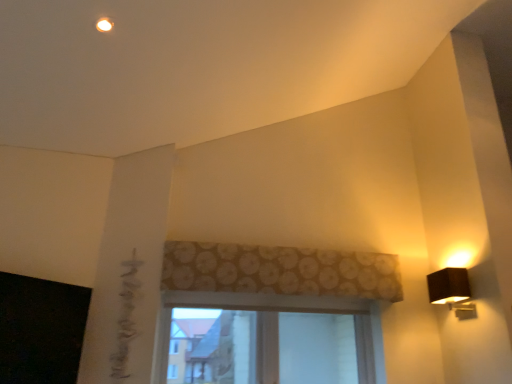
Image resolution: width=512 pixels, height=384 pixels. What are the coordinates of `black matte window screen at lower left` in the screenshot? It's located at (41, 330).

Describe the element at coordinates (452, 291) in the screenshot. I see `black fabric lamp at right` at that location.

This screenshot has height=384, width=512. Find the location of `black fabric lamp at right`. black fabric lamp at right is located at coordinates (452, 291).

The width and height of the screenshot is (512, 384). Find the location of `black matte window screen at lower left`. black matte window screen at lower left is located at coordinates (41, 330).

In the scene shown: From the image's perspective, is brown floral fabric at center beneath black fabric lamp at right?

No, from the image's perspective, brown floral fabric at center is not beneath black fabric lamp at right.

Is brown floral fabric at center positioned far away from black fabric lamp at right?

No.

Based on the photo, from a real-world perspective, is brown floral fabric at center on black fabric lamp at right?

Yes, from a real-world perspective, brown floral fabric at center is over black fabric lamp at right

Does brown floral fabric at center appear on the left side of clear glass window at center?

No, brown floral fabric at center is not to the left of clear glass window at center.

From a real-world perspective, is brown floral fabric at center located higher than clear glass window at center?

Indeed, from a real-world perspective, brown floral fabric at center stands above clear glass window at center.

Can you confirm if brown floral fabric at center is smaller than clear glass window at center?

Yes, brown floral fabric at center is smaller than clear glass window at center.

Looking at the image, does black fabric lamp at right seem bigger or smaller compared to black matte window screen at lower left?

Clearly, black fabric lamp at right is smaller in size than black matte window screen at lower left.

Can you confirm if black fabric lamp at right is shorter than black matte window screen at lower left?

Correct, black fabric lamp at right is not as tall as black matte window screen at lower left.

Between black fabric lamp at right and black matte window screen at lower left, which one is positioned in front?

black matte window screen at lower left is closer to the camera.

How distant is black fabric lamp at right from black matte window screen at lower left?

The distance of black fabric lamp at right from black matte window screen at lower left is 7.33 feet.

Is clear glass window at center at the back of black fabric lamp at right?

No, black fabric lamp at right's orientation is not away from clear glass window at center.

Considering the relative positions of black fabric lamp at right and clear glass window at center in the image provided, is black fabric lamp at right to the right of clear glass window at center from the viewer's perspective?

Yes, black fabric lamp at right is to the right of clear glass window at center.

Would you say clear glass window at center is part of black fabric lamp at right's contents?

No, clear glass window at center is not a part of black fabric lamp at right.

Considering the relative sizes of clear glass window at center and black matte window screen at lower left in the image provided, is clear glass window at center taller than black matte window screen at lower left?

Yes.

Is clear glass window at center touching black matte window screen at lower left?

No, clear glass window at center is not making contact with black matte window screen at lower left.

How different are the orientations of clear glass window at center and black matte window screen at lower left in degrees?

45.6 degrees separate the facing orientations of clear glass window at center and black matte window screen at lower left.

Does black matte window screen at lower left turn towards black fabric lamp at right?

No, black matte window screen at lower left is not facing towards black fabric lamp at right.

Is black matte window screen at lower left at the right side of black fabric lamp at right?

Incorrect, black matte window screen at lower left is not on the right side of black fabric lamp at right.

How different are the orientations of black matte window screen at lower left and black fabric lamp at right in degrees?

137 degrees.

Locate an element on the screen. lamp behind the black matte window screen at lower left is located at coordinates (452, 291).

Does black matte window screen at lower left touch clear glass window at center?

No, black matte window screen at lower left is not beside clear glass window at center.

You are a GUI agent. You are given a task and a screenshot of the screen. Output one action in this format:
    pyautogui.click(x=<x>, y=<y>)
    Task: Click on the window below the black matte window screen at lower left (from the image's perspective)
    The image size is (512, 384).
    Given the screenshot: What is the action you would take?
    pyautogui.click(x=281, y=311)

From a real-world perspective, is black matte window screen at lower left physically located above or below clear glass window at center?

Clearly, from a real-world perspective, black matte window screen at lower left is below clear glass window at center.

Find the location of `curtain above the black fabric lamp at right (from a real-world perspective)`. curtain above the black fabric lamp at right (from a real-world perspective) is located at coordinates (279, 270).

Where is `window behind the brown floral fabric at center`? window behind the brown floral fabric at center is located at coordinates click(281, 311).

Which object lies further to the anchor point clear glass window at center, black matte window screen at lower left or black fabric lamp at right?

Based on the image, black matte window screen at lower left appears to be further to clear glass window at center.

Estimate the real-world distances between objects in this image. Which object is closer to black fabric lamp at right, black matte window screen at lower left or clear glass window at center?

The object closer to black fabric lamp at right is clear glass window at center.

Which object lies further to the anchor point brown floral fabric at center, clear glass window at center or black fabric lamp at right?

black fabric lamp at right is positioned further to the anchor brown floral fabric at center.

When comparing their distances from brown floral fabric at center, does black fabric lamp at right or clear glass window at center seem further?

black fabric lamp at right is further to brown floral fabric at center.

Looking at the image, which one is located further to clear glass window at center, black fabric lamp at right or brown floral fabric at center?

black fabric lamp at right is positioned further to the anchor clear glass window at center.

From the image, which object appears to be nearer to brown floral fabric at center, black matte window screen at lower left or black fabric lamp at right?

Among the two, black fabric lamp at right is located nearer to brown floral fabric at center.

Looking at the image, which one is located further to clear glass window at center, brown floral fabric at center or black matte window screen at lower left?

black matte window screen at lower left is positioned further to the anchor clear glass window at center.

Looking at the image, which one is located closer to black fabric lamp at right, clear glass window at center or black matte window screen at lower left?

Based on the image, clear glass window at center appears to be nearer to black fabric lamp at right.

Where is `curtain between clear glass window at center and black fabric lamp at right`? This screenshot has height=384, width=512. curtain between clear glass window at center and black fabric lamp at right is located at coordinates (279, 270).

Find the location of a particular element. The image size is (512, 384). window located between black matte window screen at lower left and brown floral fabric at center in the left-right direction is located at coordinates (281, 311).

Locate an element on the screen. Image resolution: width=512 pixels, height=384 pixels. curtain between black matte window screen at lower left and black fabric lamp at right is located at coordinates (279, 270).

At what (x,y) coordinates should I click in order to perform the action: click on window between black matte window screen at lower left and black fabric lamp at right from left to right. Please return your answer as a coordinate pair (x, y). Looking at the image, I should click on [x=281, y=311].